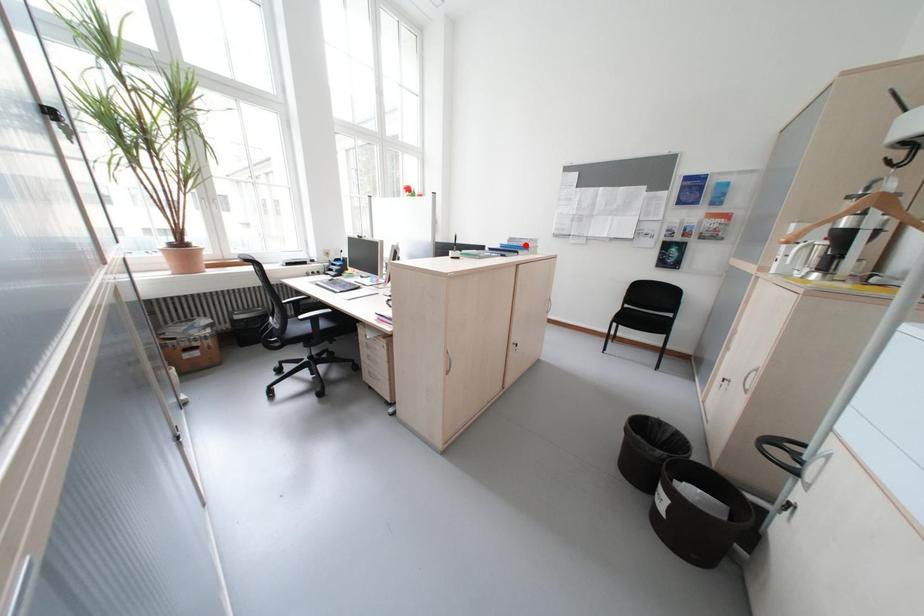
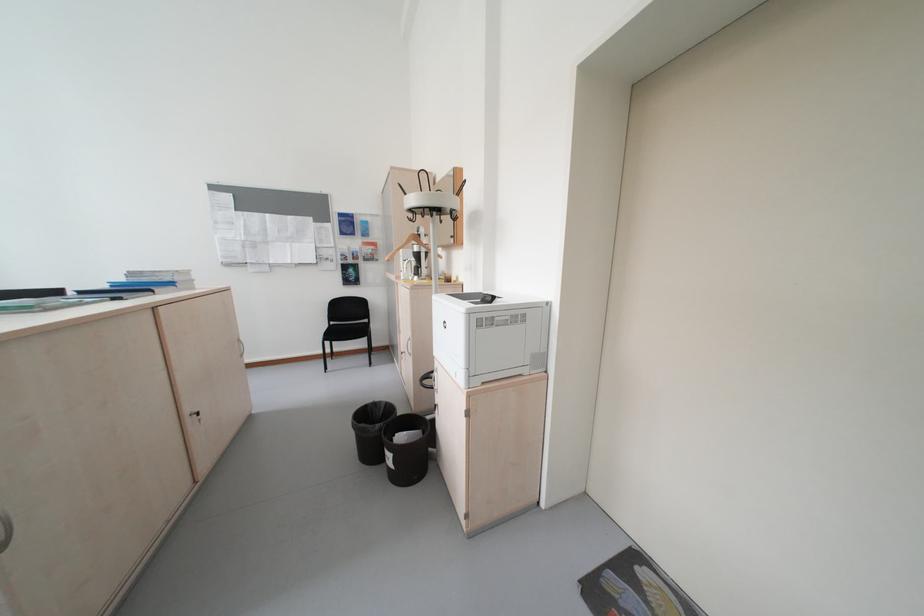
The point at the highlighted location is marked in the first image. Where is the corresponding point in the second image?

(155, 281)